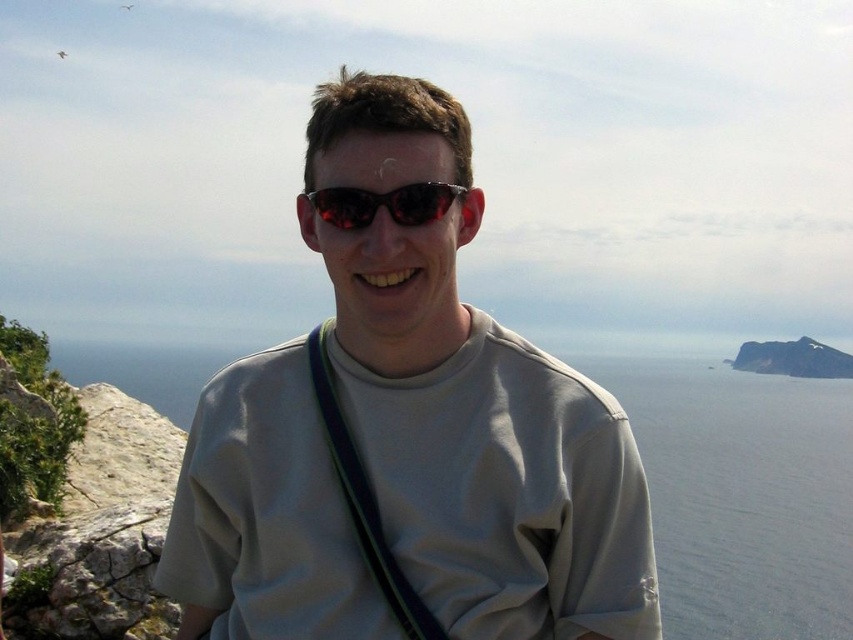
Between gray matte shirt at center and shiny dark sunglasses at center, which one is positioned higher?

Positioned higher is shiny dark sunglasses at center.

Does gray matte shirt at center lie in front of shiny dark sunglasses at center?

Yes, gray matte shirt at center is in front of shiny dark sunglasses at center.

Which is in front, point (605, 596) or point (413, 216)?

Point (605, 596)

Find the location of a particular element. This screenshot has height=640, width=853. gray matte shirt at center is located at coordinates (467, 400).

Does gray matte shirt at center appear on the right side of black fabric strap at center?

No, gray matte shirt at center is not to the right of black fabric strap at center.

Measure the distance between point (444, 616) and camera.

44.16 feet

Between point (390, 106) and point (346, 456), which one is positioned behind?

The point (346, 456) is behind.

Identify the location of gray matte shirt at center. The image size is (853, 640). (467, 400).

From the picture: Can you confirm if black fabric strap at center is smaller than shiny dark sunglasses at center?

Incorrect, black fabric strap at center is not smaller in size than shiny dark sunglasses at center.

Does black fabric strap at center have a lesser width compared to shiny dark sunglasses at center?

Indeed, black fabric strap at center has a lesser width compared to shiny dark sunglasses at center.

Is point (344, 477) less distant than point (448, 198)?

Yes, point (344, 477) is in front of point (448, 198).

Locate an element on the screen. The image size is (853, 640). black fabric strap at center is located at coordinates (364, 499).